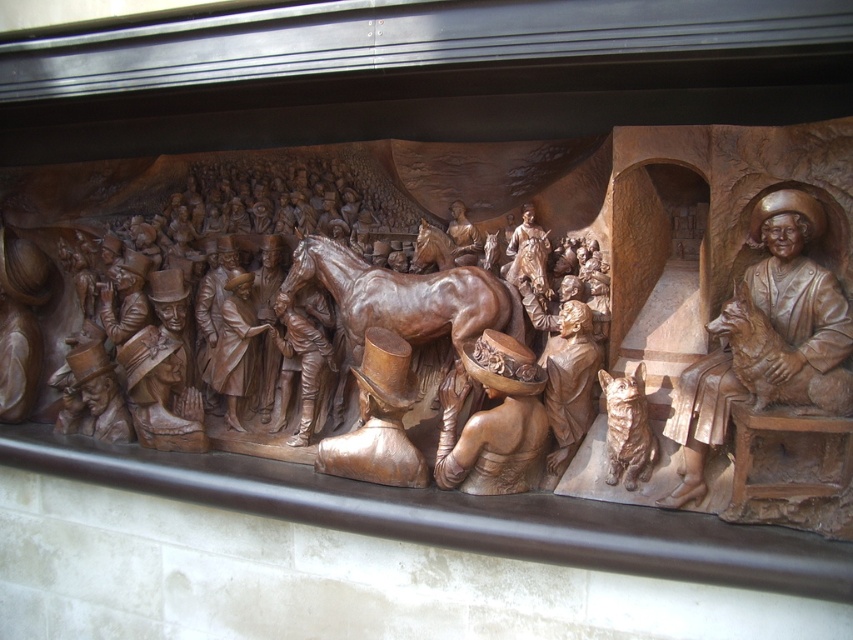
Question: Can you confirm if polished brown horse at center is positioned below matte brown boot at center?

Choices:
 (A) yes
 (B) no

Answer: (B)

Question: Which object is farther from the camera taking this photo?

Choices:
 (A) polished brown horse at center
 (B) matte brown boot at center
 (C) wooden hat at center
 (D) bronze statue of man with dog at right

Answer: (B)

Question: Does wooden hat at center appear on the right side of matte brown boot at center?

Choices:
 (A) yes
 (B) no

Answer: (A)

Question: Among these objects, which one is farthest from the camera?

Choices:
 (A) matte brown boot at center
 (B) bronze statue of man with dog at right
 (C) wooden hat at center
 (D) polished brown horse at center

Answer: (A)

Question: Estimate the real-world distances between objects in this image. Which object is closer to the polished brown horse at center?

Choices:
 (A) wooden hat at center
 (B) bronze statue of man with dog at right

Answer: (A)

Question: Is bronze statue of man with dog at right to the left of matte brown boot at center from the viewer's perspective?

Choices:
 (A) yes
 (B) no

Answer: (B)